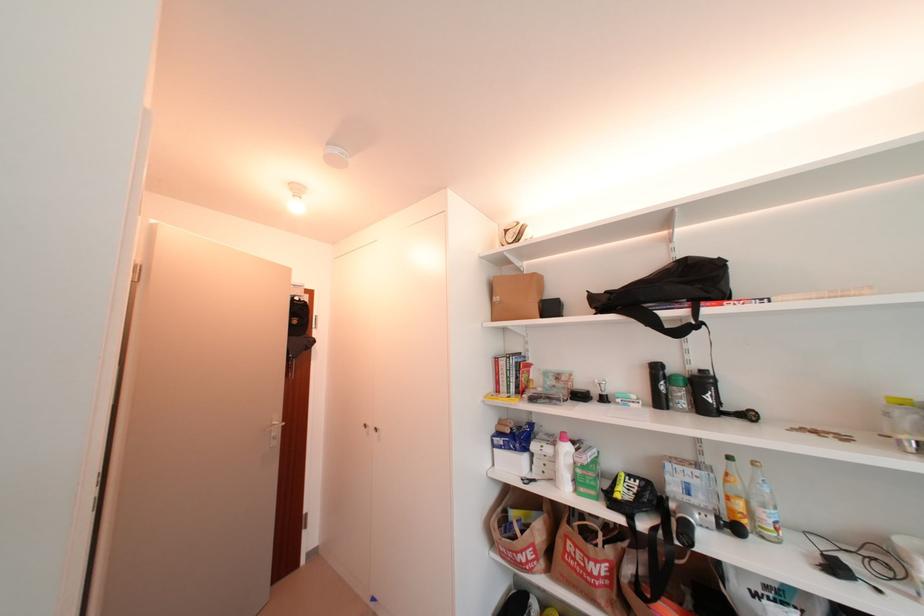
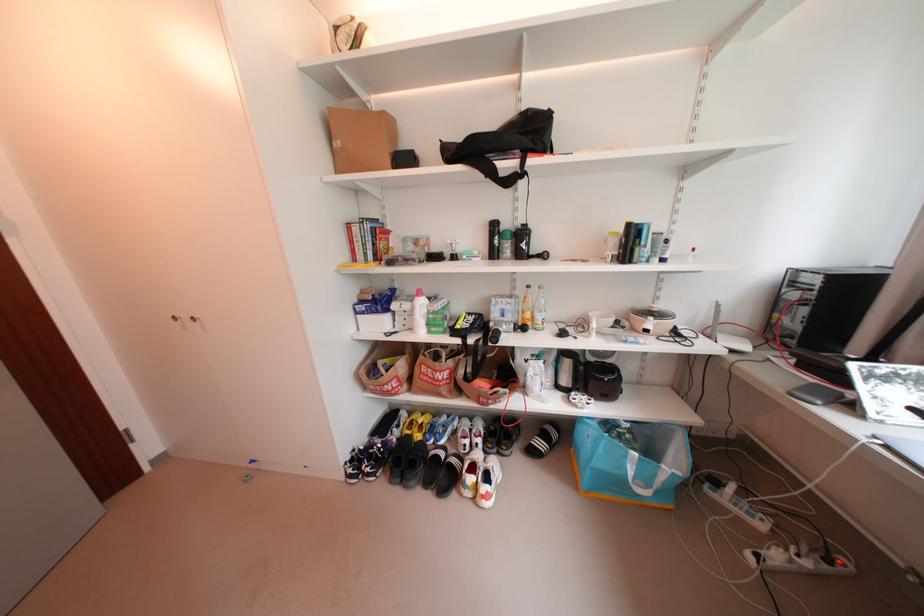
Locate, in the second image, the point that corresponds to (x=503, y=300) in the first image.

(343, 145)